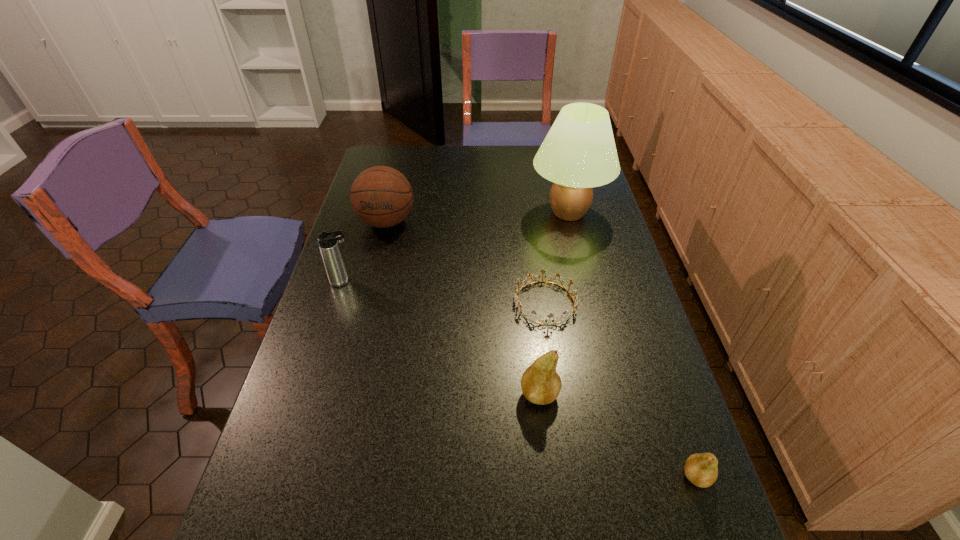
Locate an element on the screen. vacant space that satisfies the following two spatial constraints: 1. on the back side of the second nearest object; 2. on the handle side of the thermos bottle is located at coordinates (527, 281).

The height and width of the screenshot is (540, 960). What are the coordinates of `vacant area in the image that satisfies the following two spatial constraints: 1. on the handle side of the taller pear; 2. on the left side of the thermos bottle` in the screenshot? It's located at (308, 394).

Locate an element on the screen. Image resolution: width=960 pixels, height=540 pixels. free region that satisfies the following two spatial constraints: 1. on the handle side of the thermos bottle; 2. on the right side of the nearest object is located at coordinates (282, 476).

At what (x,y) coordinates should I click in order to perform the action: click on vacant area that satisfies the following two spatial constraints: 1. on the shade of the lampshade; 2. on the front-facing side of the shortest object. Please return your answer as a coordinate pair (x, y). This screenshot has height=540, width=960. Looking at the image, I should click on (590, 303).

You are a GUI agent. You are given a task and a screenshot of the screen. Output one action in this format:
    pyautogui.click(x=<x>, y=<y>)
    Task: Click on the blank space that satisfies the following two spatial constraints: 1. on the side with brand label of the basketball; 2. on the handle side of the thermos bottle
    
    Given the screenshot: What is the action you would take?
    pyautogui.click(x=372, y=281)

At what (x,y) coordinates should I click in order to perform the action: click on vacant position in the image that satisfies the following two spatial constraints: 1. on the shade of the tallest object; 2. on the front-facing side of the shortest object. Please return your answer as a coordinate pair (x, y). This screenshot has width=960, height=540. Looking at the image, I should click on (590, 303).

At what (x,y) coordinates should I click in order to perform the action: click on free space that satisfies the following two spatial constraints: 1. on the shade of the tallest object; 2. on the front-facing side of the tiara. Please return your answer as a coordinate pair (x, y). This screenshot has height=540, width=960. Looking at the image, I should click on (590, 303).

Identify the location of free space in the image that satisfies the following two spatial constraints: 1. on the side with brand label of the nearer pear; 2. on the right side of the basketball. (323, 476).

Identify the location of vacant position in the image that satisfies the following two spatial constraints: 1. on the shade of the tallest object; 2. on the back side of the nearest object. (633, 476).

Locate an element on the screen. vacant space that satisfies the following two spatial constraints: 1. on the shade of the tallest object; 2. on the front-facing side of the shortest object is located at coordinates (590, 303).